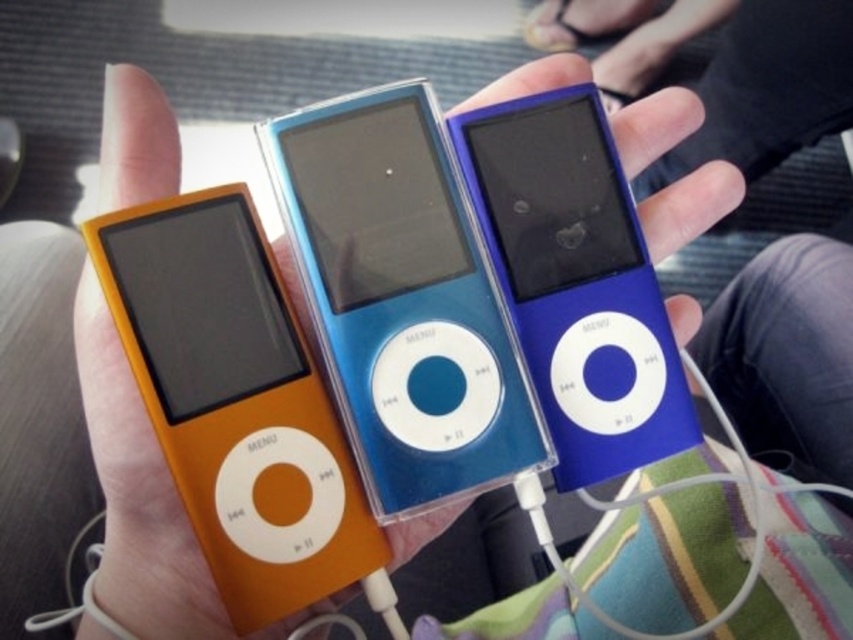
Question: Which point appears farthest from the camera in this image?

Choices:
 (A) (288, 291)
 (B) (273, 536)
 (C) (349, 170)
 (D) (637, 266)

Answer: (D)

Question: Where is matte blue ipod at center located in relation to blue glossy ipod at center in the image?

Choices:
 (A) right
 (B) left

Answer: (B)

Question: Considering the relative positions of orange matte ipod at left and blue glossy ipod at center in the image provided, where is orange matte ipod at left located with respect to blue glossy ipod at center?

Choices:
 (A) above
 (B) below

Answer: (B)

Question: Which object is farther from the camera taking this photo?

Choices:
 (A) orange matte ipod at left
 (B) matte blue ipod at center
 (C) blue glossy ipod at center
 (D) orange glossy ipod at center

Answer: (C)

Question: Which point is closer to the camera?

Choices:
 (A) (213, 394)
 (B) (610, 314)
 (C) (367, 493)

Answer: (A)

Question: Observing the image, what is the correct spatial positioning of orange matte ipod at left in reference to blue glossy ipod at center?

Choices:
 (A) right
 (B) left

Answer: (B)